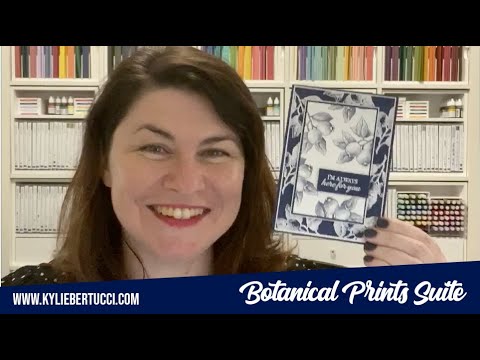
Locate an element on the screen. The height and width of the screenshot is (360, 480). wall is located at coordinates (475, 112), (7, 223).